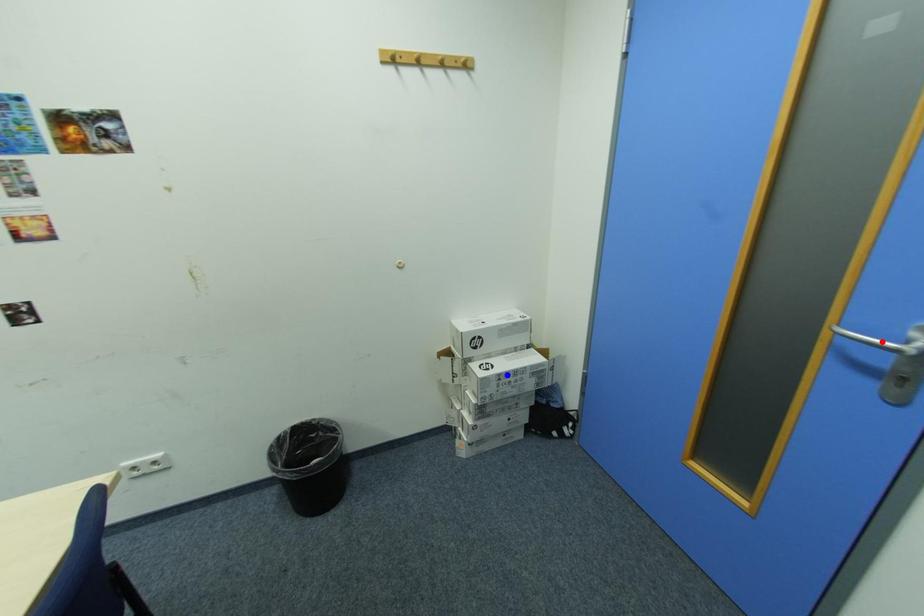
Question: In the image, two points are highlighted. Which point is nearer to the camera? Reply with the corresponding letter.

Choices:
 (A) blue point
 (B) red point

Answer: (B)